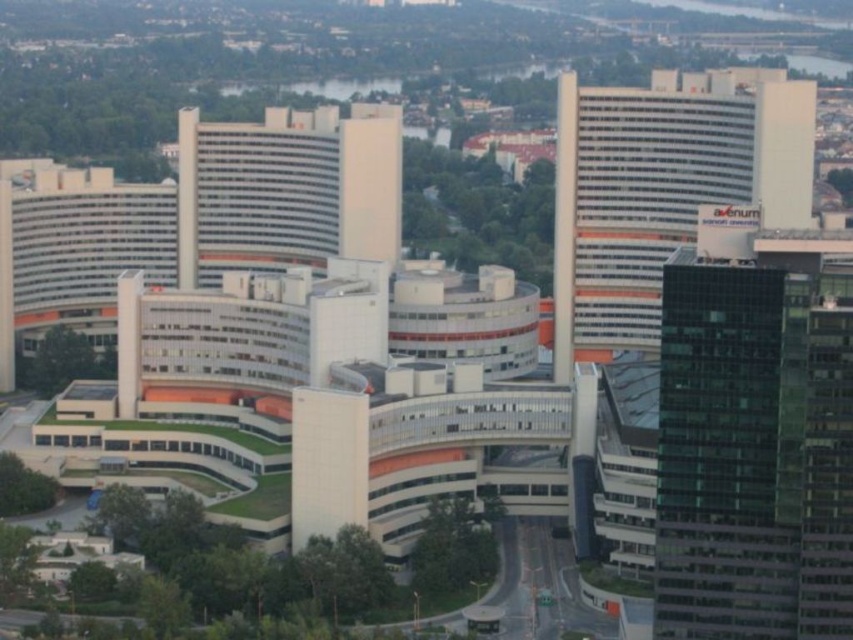
Is white glass building at center shorter than white glossy building at center?

Incorrect, white glass building at center's height does not fall short of white glossy building at center's.

Does white glass building at center have a larger size compared to white glossy building at center?

Yes.

Find the location of a particular element. This screenshot has width=853, height=640. white glass building at center is located at coordinates pyautogui.click(x=663, y=188).

Is green glass skyscraper at right above white glass building at center?

Actually, green glass skyscraper at right is below white glass building at center.

Can you confirm if green glass skyscraper at right is shorter than white glass building at center?

Yes.

What are the coordinates of `green glass skyscraper at right` in the screenshot? It's located at (756, 442).

The height and width of the screenshot is (640, 853). Identify the location of green glass skyscraper at right. (756, 442).

Is green glass skyscraper at right positioned in front of white glossy building at center?

Yes, it is.

Can you confirm if green glass skyscraper at right is positioned below white glossy building at center?

Indeed, green glass skyscraper at right is positioned under white glossy building at center.

Is point (825, 490) farther from viewer compared to point (223, 140)?

No, (825, 490) is closer to viewer.

Image resolution: width=853 pixels, height=640 pixels. What are the coordinates of `green glass skyscraper at right` in the screenshot? It's located at (756, 442).